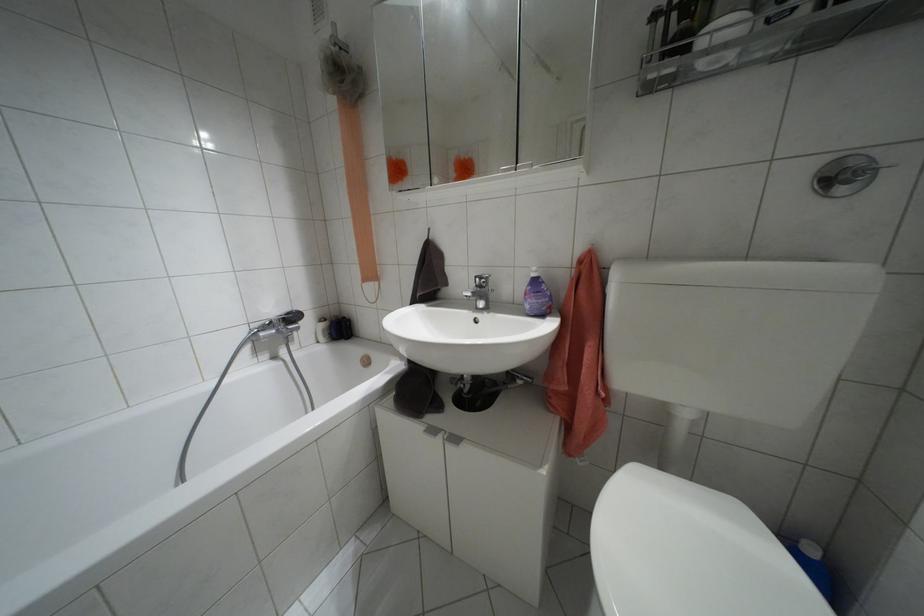
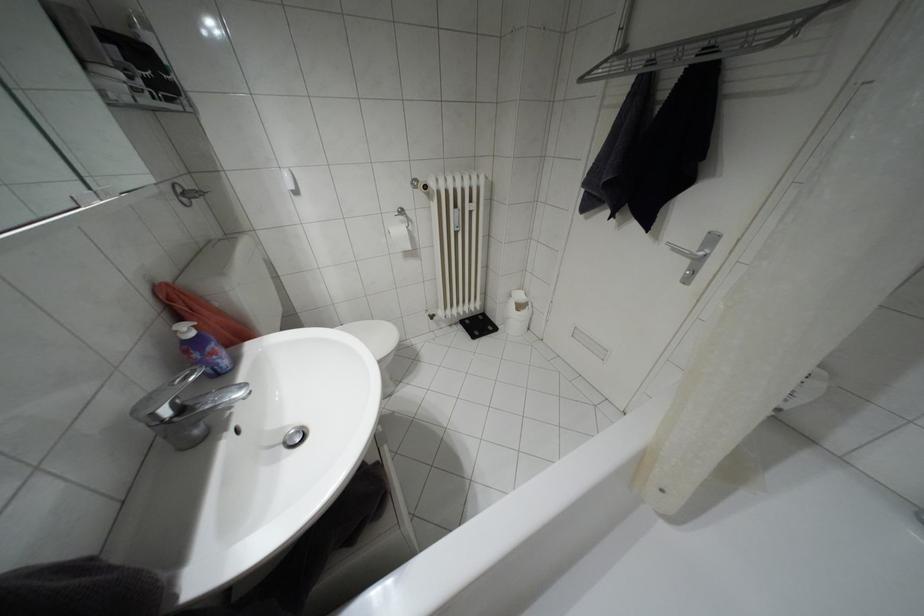
Question: I am providing you with two images of the same scene from different viewpoints. Please identify which objects are invisible in image2.

Choices:
 (A) white trash can
 (B) black digital scale
 (C) silver door handle
 (D) none of these

Answer: (D)